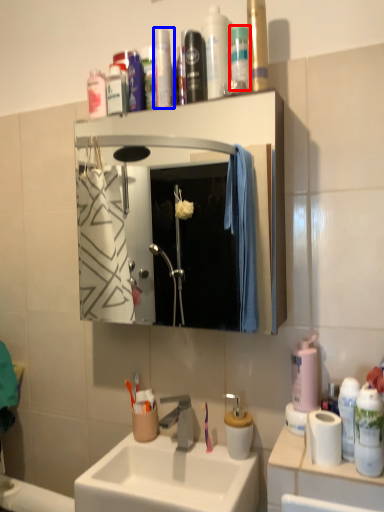
Question: Which object appears closest to the camera in this image, mouthwash (highlighted by a red box) or toiletry (highlighted by a blue box)?

Choices:
 (A) mouthwash
 (B) toiletry

Answer: (A)